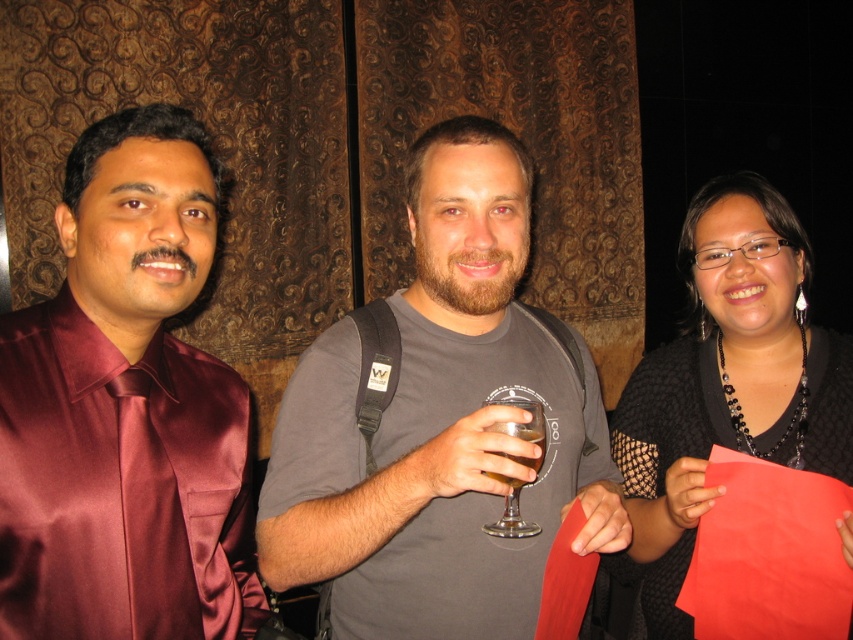
Question: Which of the following is the farthest from the observer?

Choices:
 (A) (523, 460)
 (B) (515, 458)
 (C) (798, 452)
 (D) (132, 132)

Answer: (C)

Question: Does maroon satin shirt at left appear on the left side of black mesh dress at right?

Choices:
 (A) yes
 (B) no

Answer: (A)

Question: Can you confirm if maroon satin shirt at left is thinner than clear glass wine glass at center?

Choices:
 (A) no
 (B) yes

Answer: (A)

Question: Is maroon satin shirt at left positioned at the back of translucent glass at center?

Choices:
 (A) yes
 (B) no

Answer: (B)

Question: Which point appears farthest from the camera in this image?

Choices:
 (A) (538, 460)
 (B) (590, 440)

Answer: (B)

Question: Which point is closer to the camera taking this photo?

Choices:
 (A) (515, 477)
 (B) (509, 483)
 (C) (790, 404)

Answer: (A)